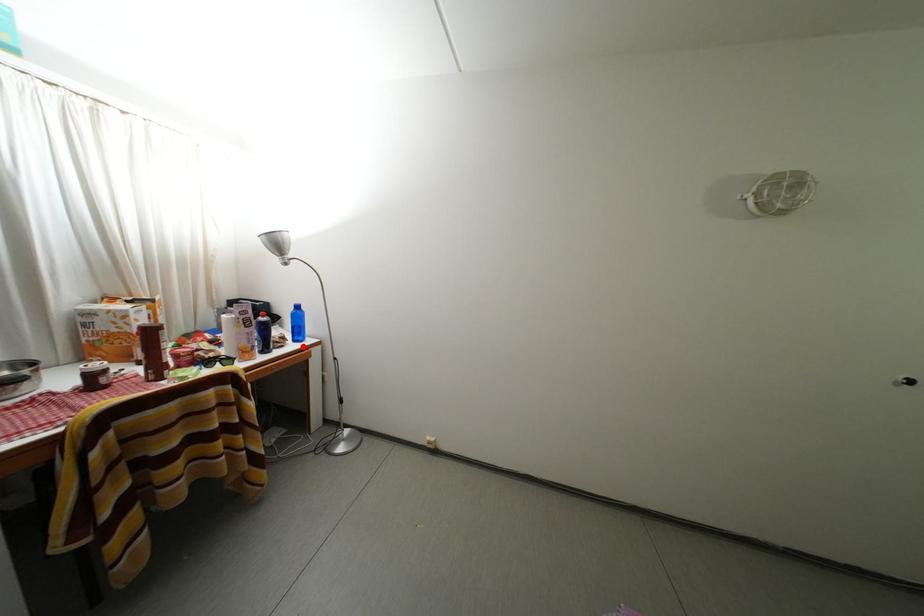
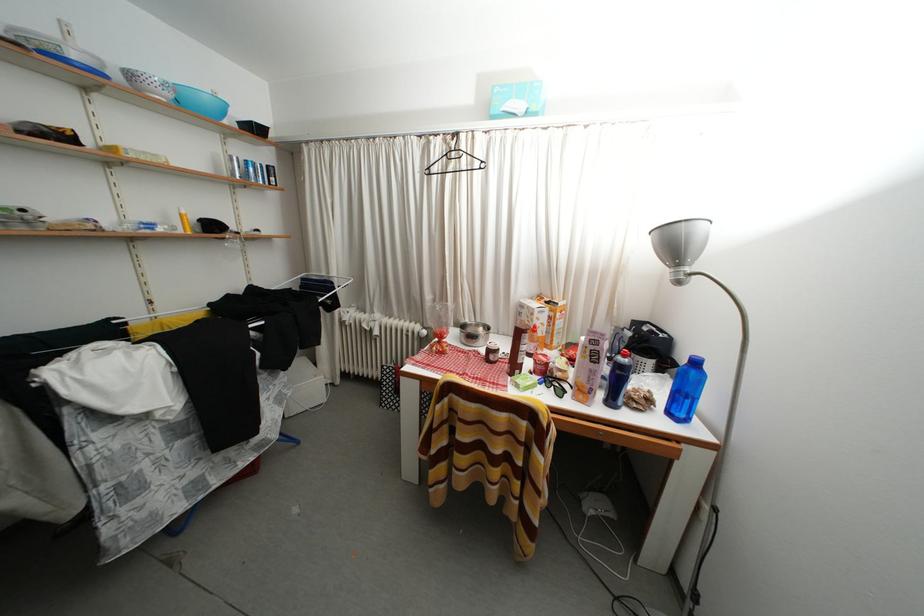
The point at the highlighted location is marked in the first image. Where is the corresponding point in the second image?

(676, 419)